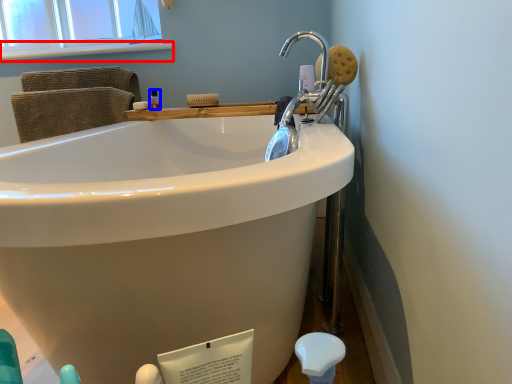
Question: Which of the following is the closest to the observer, window sill (highlighted by a red box) or mouthwash (highlighted by a blue box)?

Choices:
 (A) window sill
 (B) mouthwash

Answer: (B)